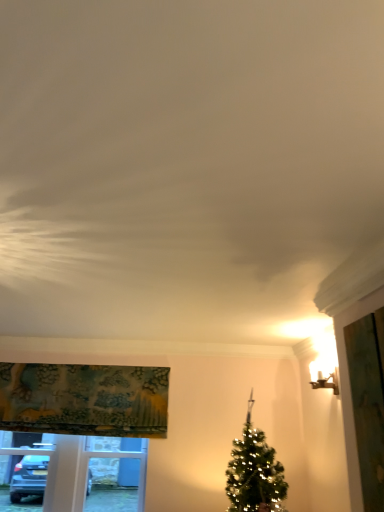
Question: From a real-world perspective, is green fabric screen door at right physically located above or below white plastic window frame at lower left?

Choices:
 (A) above
 (B) below

Answer: (A)

Question: Is green fabric screen door at right situated inside white plastic window frame at lower left or outside?

Choices:
 (A) inside
 (B) outside

Answer: (B)

Question: Which of these objects is positioned closest to the green fabric screen door at right?

Choices:
 (A) matte gold sconce at upper right
 (B) textured fabric curtain at upper left
 (C) white plastic window frame at lower left

Answer: (A)

Question: Based on their relative distances, which object is farther from the white plastic window frame at lower left?

Choices:
 (A) matte gold sconce at upper right
 (B) green fabric screen door at right
 (C) textured fabric curtain at upper left

Answer: (B)